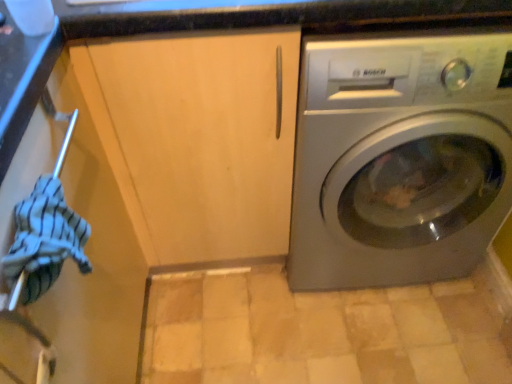
Question: Considering the positions of matte wood cabinet at center and satin silver washing machine at right in the image, is matte wood cabinet at center wider or thinner than satin silver washing machine at right?

Choices:
 (A) thin
 (B) wide

Answer: (A)

Question: Relative to satin silver washing machine at right, is matte wood cabinet at center in front or behind?

Choices:
 (A) behind
 (B) front

Answer: (B)

Question: Considering the real-world distances, which object is closest to the satin silver washing machine at right?

Choices:
 (A) matte wood cabinet at center
 (B) striped cotton towel at left

Answer: (A)

Question: Based on their relative distances, which object is farther from the satin silver washing machine at right?

Choices:
 (A) matte wood cabinet at center
 (B) striped cotton towel at left

Answer: (B)